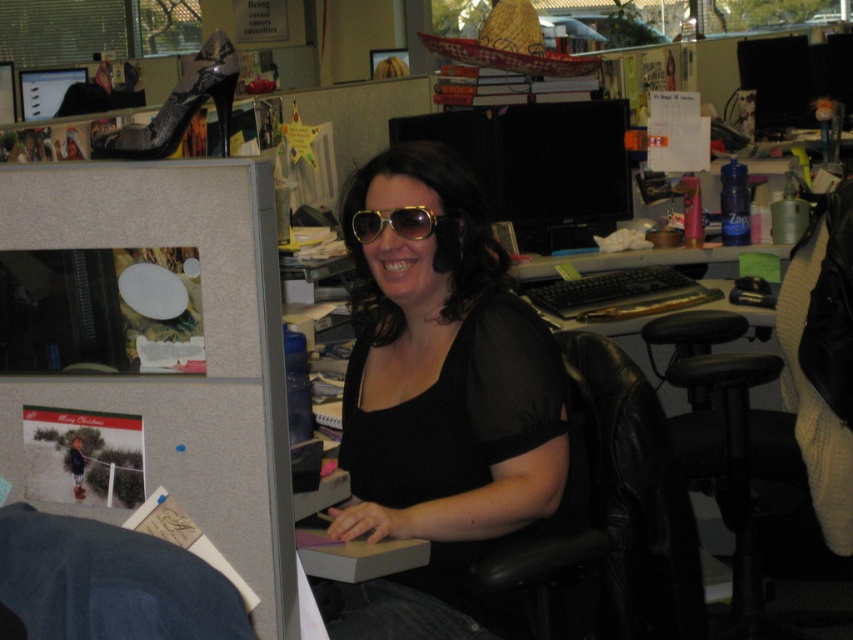
Question: Among these objects, which one is farthest from the camera?

Choices:
 (A) denim swivel chair at lower left
 (B) black leather swivel chair at right
 (C) matte black shirt at center

Answer: (B)

Question: Does matte black shirt at center have a larger size compared to black leather swivel chair at right?

Choices:
 (A) yes
 (B) no

Answer: (B)

Question: Can you confirm if black leather swivel chair at right is positioned above black leather chair at center?

Choices:
 (A) no
 (B) yes

Answer: (A)

Question: Which of the following is the closest to the observer?

Choices:
 (A) (195, 572)
 (B) (695, 582)
 (C) (753, 412)

Answer: (A)

Question: Does black leather chair at center appear over gold textured sunglasses at center?

Choices:
 (A) yes
 (B) no

Answer: (B)

Question: Which object is closer to the camera taking this photo?

Choices:
 (A) gold textured sunglasses at center
 (B) black leather chair at center
 (C) matte black shirt at center
 (D) black leather swivel chair at right

Answer: (C)